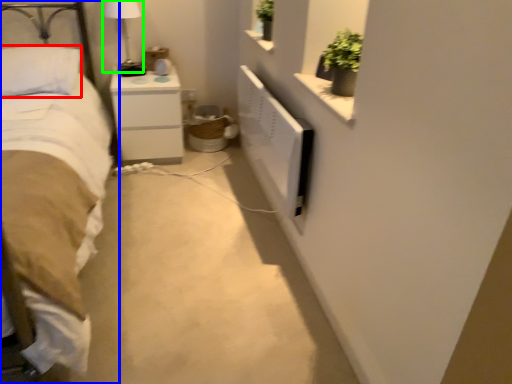
Question: Based on their relative distances, which object is farther from pillow (highlighted by a red box)? Choose from bed (highlighted by a blue box) and bedside lamp (highlighted by a green box).

Choices:
 (A) bed
 (B) bedside lamp

Answer: (B)